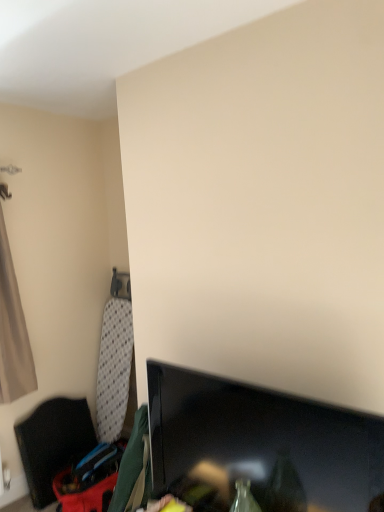
Question: Visually, is beige fabric curtain at left positioned to the left or to the right of black glossy tv at lower right?

Choices:
 (A) left
 (B) right

Answer: (A)

Question: From a real-world perspective, is beige fabric curtain at left physically located above or below black glossy tv at lower right?

Choices:
 (A) below
 (B) above

Answer: (B)

Question: Estimate the real-world distances between objects in this image. Which object is farther from the black fabric chair at left?

Choices:
 (A) beige fabric curtain at left
 (B) black glossy tv at lower right

Answer: (B)

Question: Based on their relative distances, which object is nearer to the black fabric chair at left?

Choices:
 (A) beige fabric curtain at left
 (B) black glossy tv at lower right

Answer: (A)